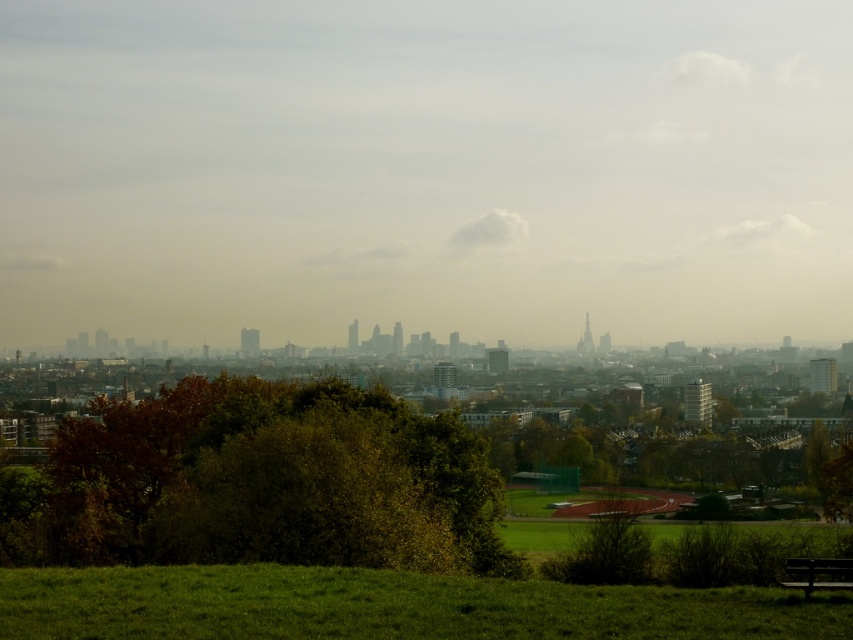
You are standing in the park and want to sit on the wooden bench at lower right. Which direction should you walk from the green grassy field at lower center to reach the bench?

The wooden bench at lower right is further away from the viewer than the green grassy field at lower center. Therefore, you should walk towards the direction of the bench, which is to your right and forward, since the bench is located at a greater distance from your current position on the grassy field.

You are standing in the park and want to sit on the wooden bench at lower right. Which direction should you walk to reach it from the green leafy tree at center?

You should walk to the right to reach the wooden bench at lower right from the green leafy tree at center, since the green leafy tree at center is to the left of the wooden bench at lower right.